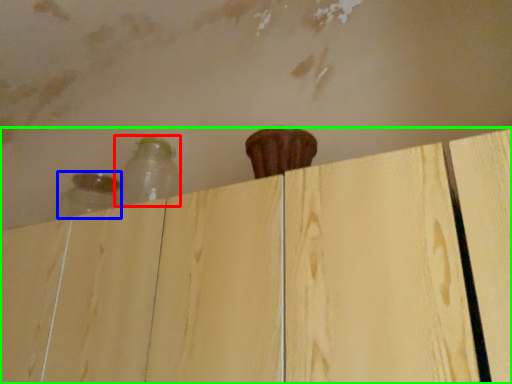
Question: Based on their relative distances, which object is farther from bottle (highlighted by a red box)? Choose from bottle (highlighted by a blue box) and dresser (highlighted by a green box).

Choices:
 (A) bottle
 (B) dresser

Answer: (B)